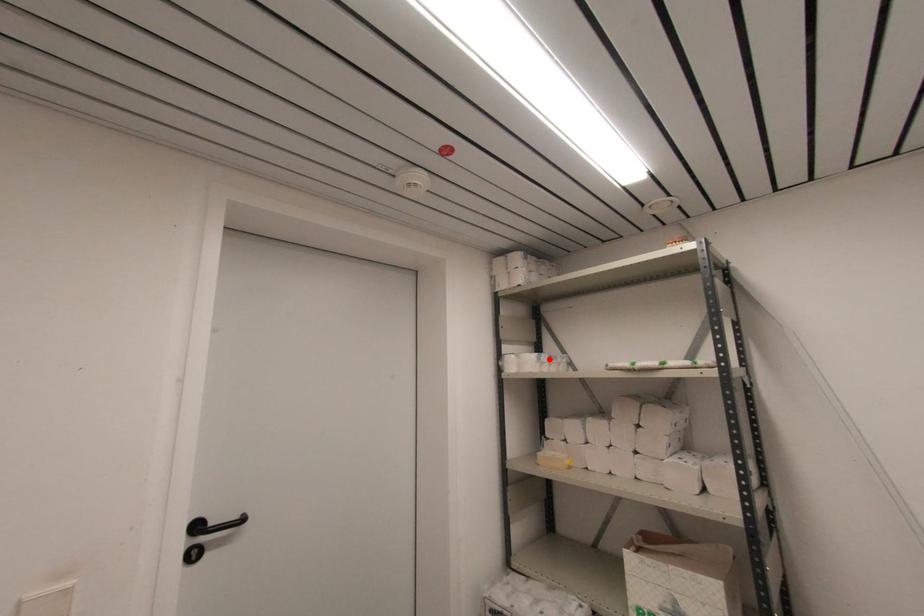
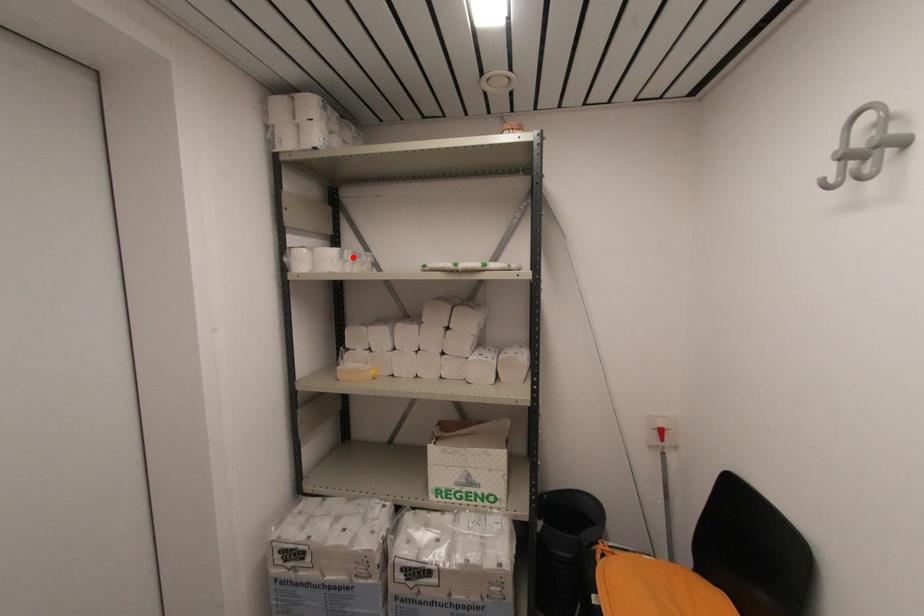
I am providing you with two images of the same scene from different viewpoints. A red point is marked on the first image and another point is marked on the second image. Do the highlighted points in image1 and image2 indicate the same real-world spot?

Yes